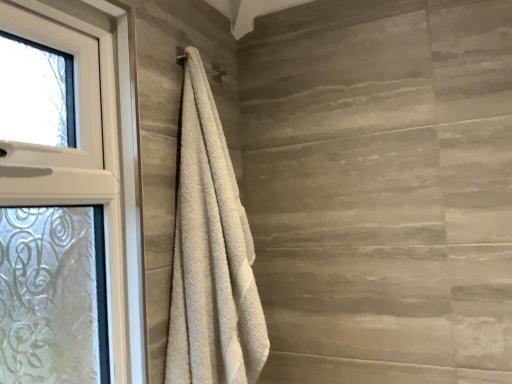
Where is `white fluffy towel at center`? Image resolution: width=512 pixels, height=384 pixels. white fluffy towel at center is located at coordinates (211, 254).

What do you see at coordinates (211, 254) in the screenshot? The image size is (512, 384). I see `white fluffy towel at center` at bounding box center [211, 254].

Locate an element on the screen. white fluffy towel at center is located at coordinates (211, 254).